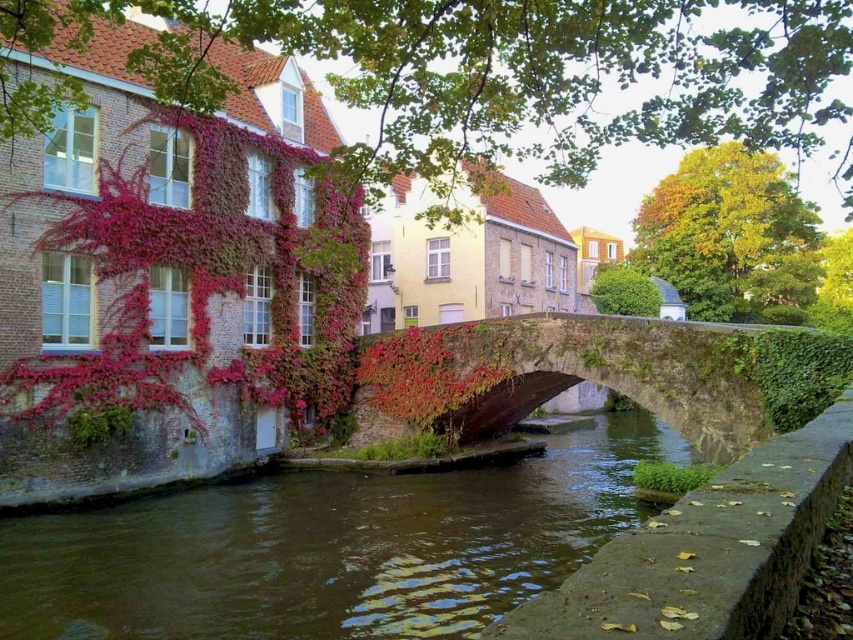
You are a tourist standing on the stone bridge at center and want to take a photo of the brown stone river at center. Which direction should you face to capture the river in your shot?

The brown stone river at center is positioned on the left side of stone bridge at center. To capture the river in your shot, you should face to the left side from the stone bridge at center.

You are standing at the center of the bridge and want to locate the brown stone river at center. Which direction should you look to find it?

The brown stone river at center is located at point coordinates (329, 548), so you should look towards the center of the bridge to find it.